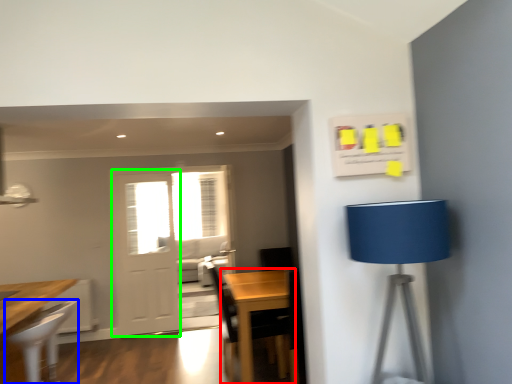
Question: Based on their relative distances, which object is farther from table (highlighted by a red box)? Choose from chair (highlighted by a blue box) and screen door (highlighted by a green box).

Choices:
 (A) chair
 (B) screen door

Answer: (B)